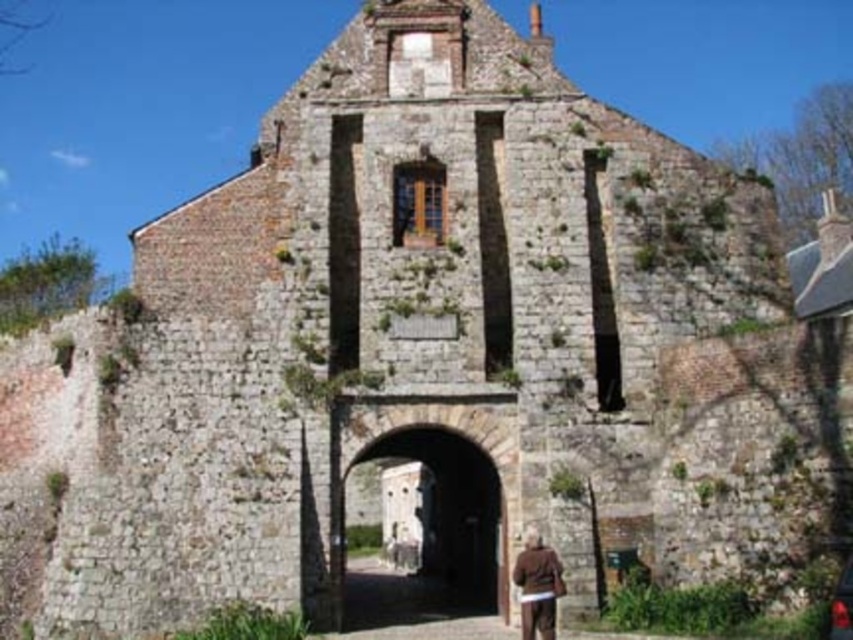
You are standing in front of the old stone building and want to take a photo of the stone archway at center and the shiny black car at lower right. Which object should you position to your left side to capture both in the frame?

You should position the shiny black car at lower right to your left side because the stone archway at center is to the left of the shiny black car at lower right, so placing the car to your left would allow both to be in the frame.